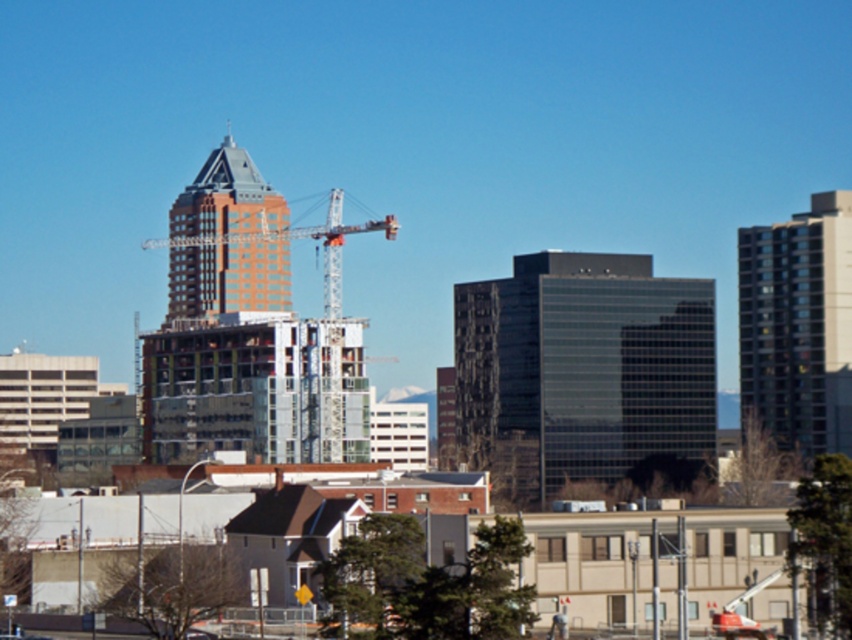
You are standing at the base of the crane and want to take a photo of the two points in the cityscape image. Which point, point [815,403] or point [332,211], is closer to your camera when taking the photo?

Point [332,211] is closer to the camera because it is less further than point [815,403].

You are a city planner analyzing the layout of this city. You need to place a new public park in the area. Considering the position of the metallic silver crane at center, which is at coordinates approximately 0.372 in the x and 0.352 in the y, where should the park be located to ensure it is equidistant from the crane and the city center? Assume the city center is at coordinates 0.5, 0.5.

The park should be placed at the midpoint between the metallic silver crane at center and the city center. Calculating the midpoint between coordinates (298, 237) and (426, 320) gives the point (361, 278). Therefore, the park should be located at approximately 0.436 in the x and 0.426 in the y to be equidistant from both the crane and the city center.